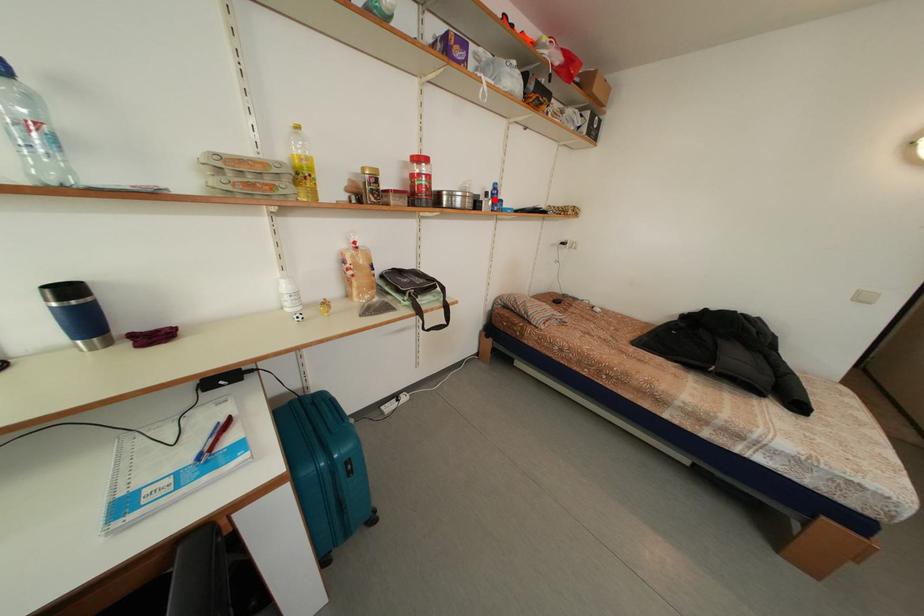
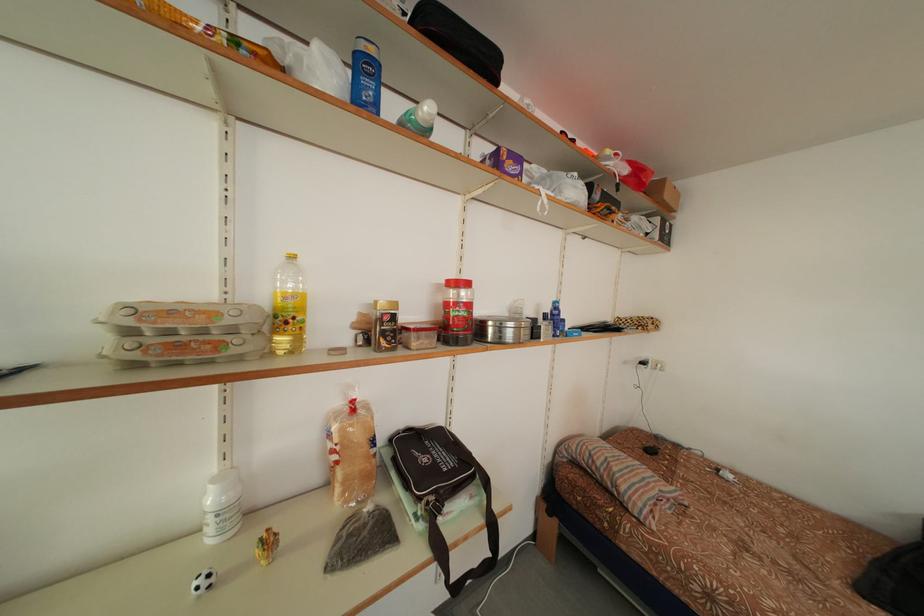
The point at the highlighted location is marked in the first image. Where is the corresponding point in the second image?

(553, 322)